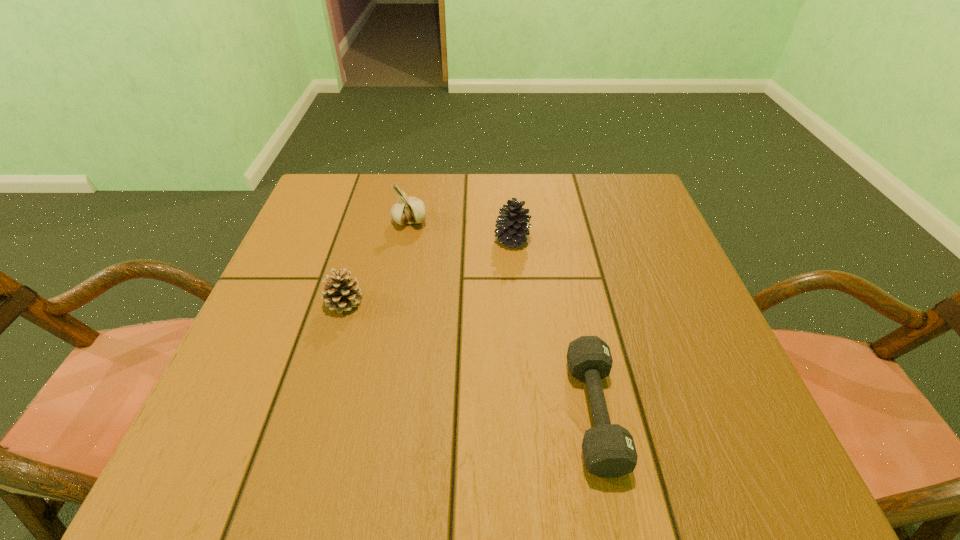
Locate an element on the screen. vacant space in between the taller pinecone and the shortest object is located at coordinates (553, 326).

Image resolution: width=960 pixels, height=540 pixels. I want to click on free spot between the garlic and the right pinecone, so click(461, 230).

You are a GUI agent. You are given a task and a screenshot of the screen. Output one action in this format:
    pyautogui.click(x=<x>, y=<y>)
    Task: Click on the vacant space that is in between the rightmost object and the nearer pinecone
    
    Given the screenshot: What is the action you would take?
    pyautogui.click(x=469, y=357)

Identify the location of free space between the shortest object and the taller pinecone. (553, 326).

What are the coordinates of `free point between the second object from left to right and the second object from right to left` in the screenshot? It's located at (461, 230).

This screenshot has height=540, width=960. Identify the location of vacant space in between the shorter pinecone and the garlic. (377, 261).

The height and width of the screenshot is (540, 960). Find the location of `vacant area that lies between the leftmost object and the rightmost object`. vacant area that lies between the leftmost object and the rightmost object is located at coordinates (469, 357).

Locate an element on the screen. Image resolution: width=960 pixels, height=540 pixels. empty location between the nearest object and the nearer pinecone is located at coordinates click(469, 357).

Where is `free space between the nearest object and the leftmost object`? free space between the nearest object and the leftmost object is located at coordinates (469, 357).

Find the location of a particular element. This screenshot has height=540, width=960. vacant area that lies between the third object from right to left and the taller pinecone is located at coordinates (461, 230).